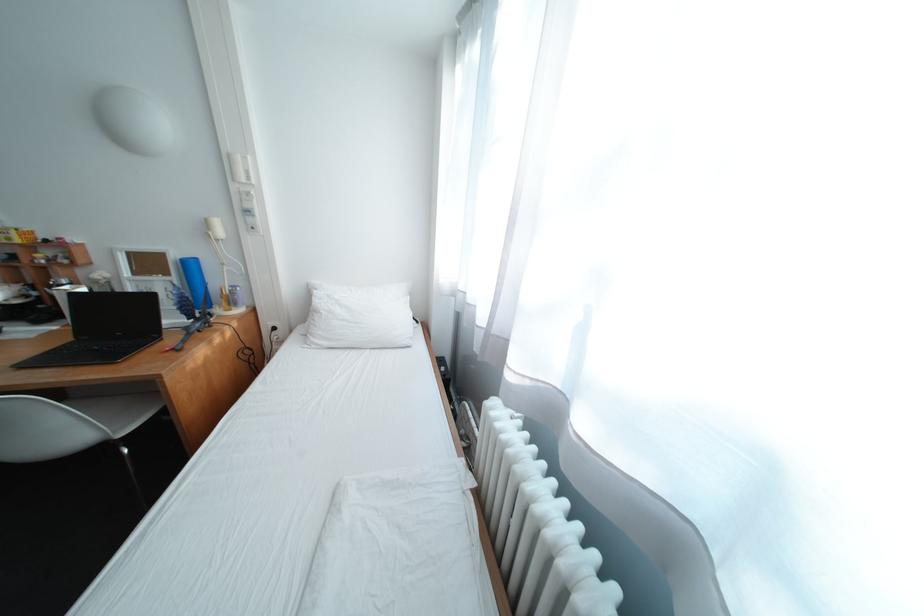
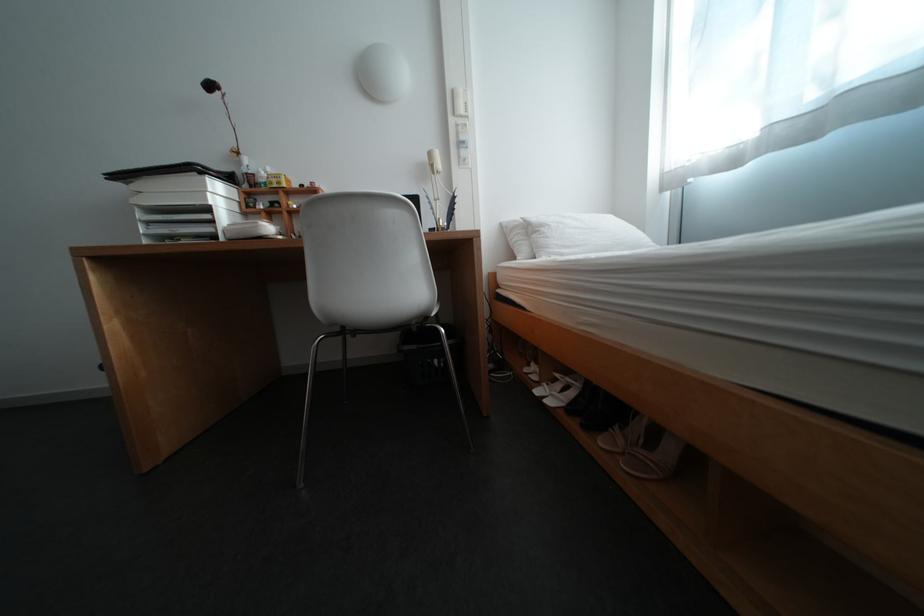
In the second image, find the point that corresponds to (140,453) in the first image.

(456, 331)